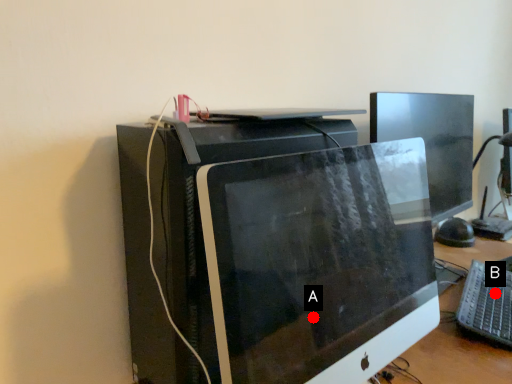
Question: Two points are circled on the image, labeled by A and B beside each circle. Which point is further to the camera?

Choices:
 (A) A is further
 (B) B is further

Answer: (A)